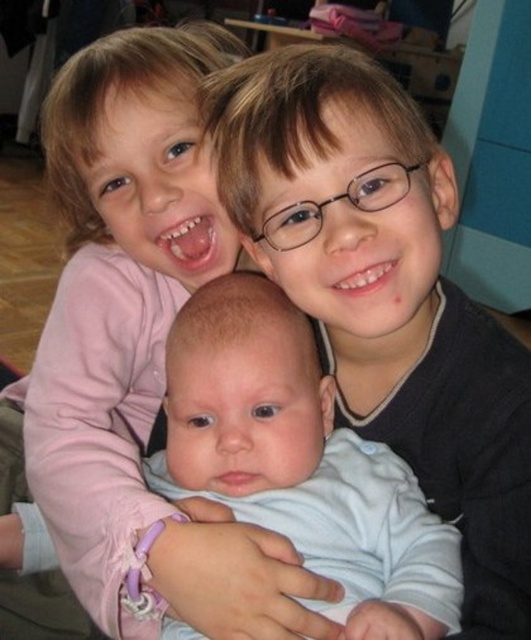
Question: Which point is farther to the camera?

Choices:
 (A) matte black sweater at center
 (B) matte pink shirt at upper left
 (C) light blue fabric baby at center

Answer: (B)

Question: Considering the real-world distances, which object is farthest from the light blue fabric baby at center?

Choices:
 (A) matte black sweater at center
 (B) matte pink shirt at upper left

Answer: (B)

Question: Among these points, which one is farthest from the camera?

Choices:
 (A) (321, 552)
 (B) (520, 580)

Answer: (B)

Question: Can you confirm if matte black sweater at center is positioned to the left of matte pink shirt at upper left?

Choices:
 (A) yes
 (B) no

Answer: (B)

Question: Is matte pink shirt at upper left to the left of light blue fabric baby at center from the viewer's perspective?

Choices:
 (A) yes
 (B) no

Answer: (A)

Question: In this image, where is matte pink shirt at upper left located relative to light blue fabric baby at center?

Choices:
 (A) right
 (B) left

Answer: (B)